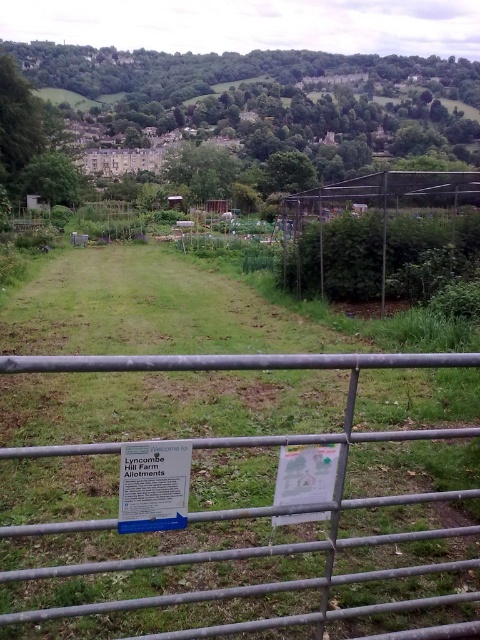
Where is `white plastic sign at center`? white plastic sign at center is located at coordinates (154, 484).

Is white plastic sign at center to the left of wire mesh fence at center from the viewer's perspective?

Indeed, white plastic sign at center is positioned on the left side of wire mesh fence at center.

Is point (120, 531) closer to viewer compared to point (322, 291)?

That is True.

At what (x,y) coordinates should I click in order to perform the action: click on white plastic sign at center. Please return your answer as a coordinate pair (x, y). The image size is (480, 640). Looking at the image, I should click on (154, 484).

Does metal gate at center lie in front of white plastic sign at center?

Yes.

Does metal gate at center have a lesser width compared to white plastic sign at center?

No.

Who is more distant from viewer, (x=280, y=582) or (x=165, y=477)?

The point (x=280, y=582) is behind.

The image size is (480, 640). Identify the location of metal gate at center. (255, 506).

Is point (384, 506) positioned behind point (351, 186)?

No, (384, 506) is closer to viewer.

Is metal gate at center in front of wire mesh fence at center?

That is True.

Find the location of a particular element. The width and height of the screenshot is (480, 640). metal gate at center is located at coordinates (255, 506).